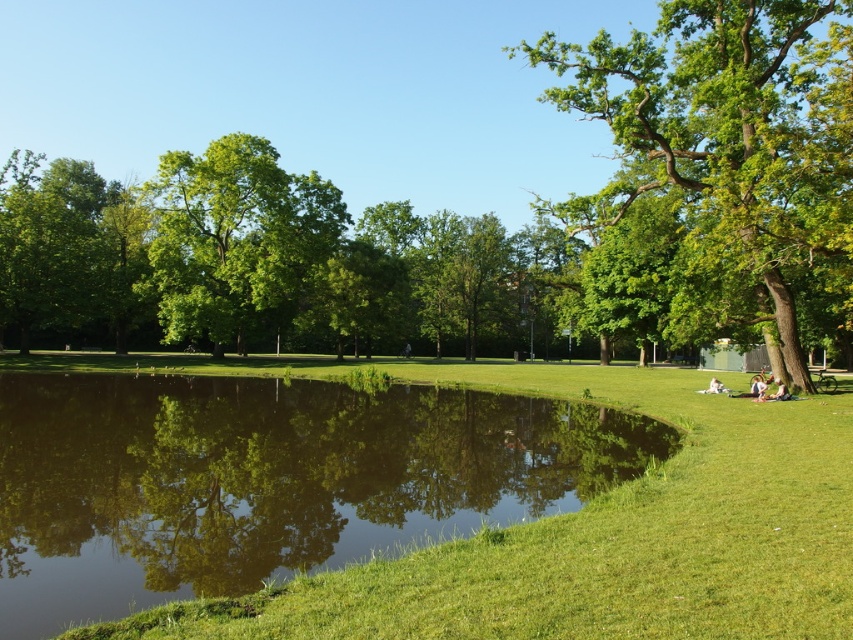
You are standing in the park and want to take a photo of the green leafy tree at right without the green reflective water at center appearing in the background. Is this possible given their positions?

The green reflective water at center is in front of the green leafy tree at right, so you cannot take a photo of the green leafy tree at right without the green reflective water at center appearing in front of it.

You are standing in the park and see the green leafy tree at center and the green leafy tree at upper left. Which tree is positioned lower in the image?

The green leafy tree at center is located below the green leafy tree at upper left, so it is positioned lower in the image.